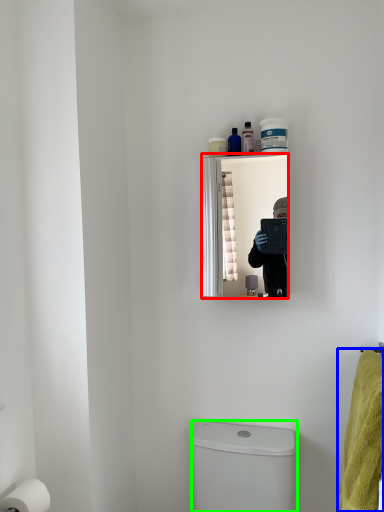
Question: Estimate the real-world distances between objects in this image. Which object is closer to mirror (highlighted by a red box), bath towel (highlighted by a blue box) or toilet bowl (highlighted by a green box)?

Choices:
 (A) bath towel
 (B) toilet bowl

Answer: (B)